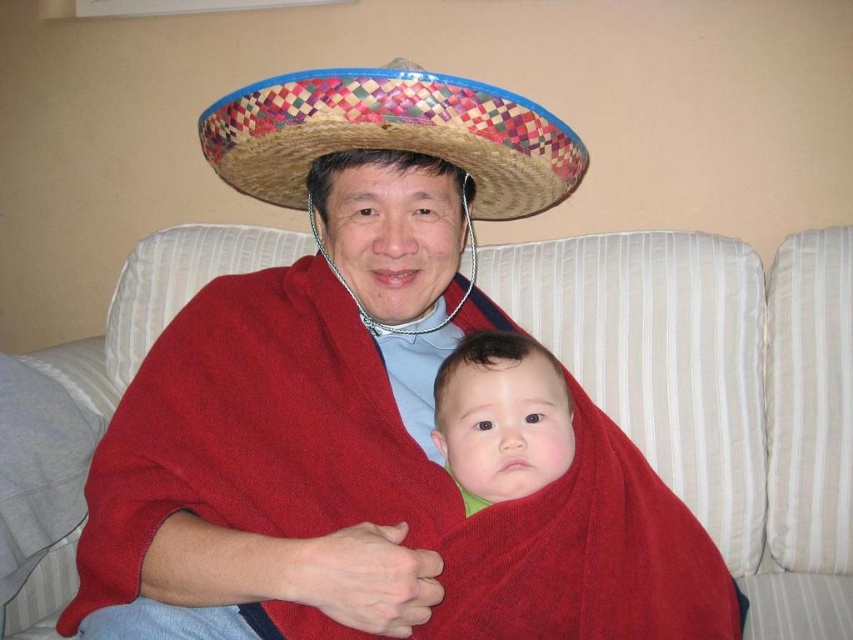
Who is positioned more to the left, woven straw sombrero at center or smooth red fabric at center?

woven straw sombrero at center

Is woven straw sombrero at center shorter than smooth red fabric at center?

No.

Between point (492, 128) and point (520, 368), which one is positioned behind?

The point (520, 368) is behind.

Locate an element on the screen. woven straw sombrero at center is located at coordinates (392, 132).

Who is higher up, white striped couch at center or woven straw sombrero at center?

Positioned higher is woven straw sombrero at center.

Does white striped couch at center have a lesser width compared to woven straw sombrero at center?

No.

Between point (798, 636) and point (335, 70), which one is positioned behind?

Positioned behind is point (798, 636).

Image resolution: width=853 pixels, height=640 pixels. I want to click on white striped couch at center, so click(718, 390).

Can you confirm if white striped couch at center is positioned below smooth red fabric at center?

No, white striped couch at center is not below smooth red fabric at center.

Can you confirm if white striped couch at center is shorter than smooth red fabric at center?

No.

In order to click on white striped couch at center in this screenshot , I will do `click(718, 390)`.